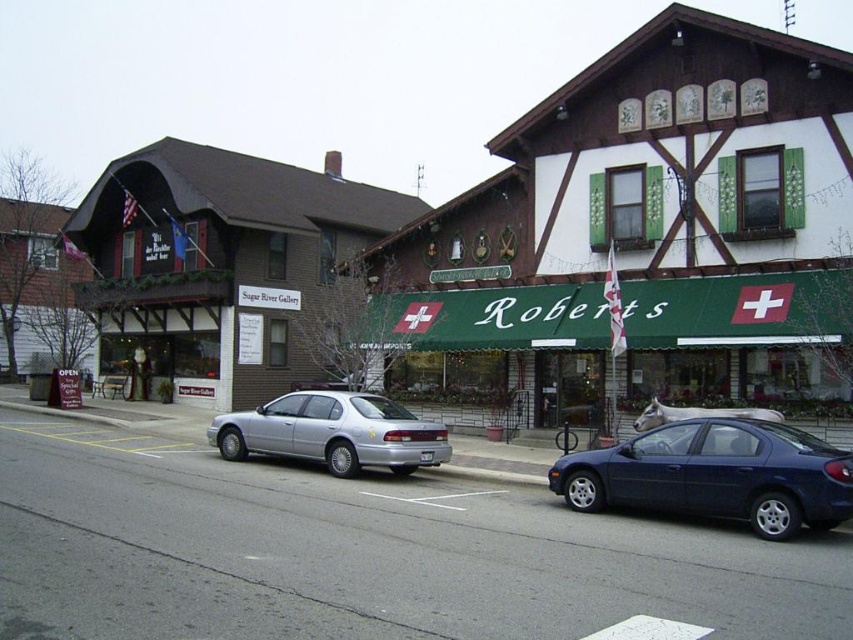
You are a delivery driver who needs to park your 1.8 meters wide truck between the glossy blue sedan at lower right and the silver metallic sedan at center. Can your truck fit in the space between them?

The glossy blue sedan at lower right has a lesser width compared to silver metallic sedan at center. Since the glossy blue sedan at lower right is narrower, the space between them might be sufficient for your 1.8 meters wide truck. However, without knowing the exact distance between the two sedans, it is difficult to confirm if the truck can fit.

You are a delivery person who needs to park your glossy blue sedan at lower right. The parking spot is in front of the brick sugar river gallery at left. Is your vehicle currently positioned correctly?

The glossy blue sedan at lower right is behind the brick sugar river gallery at left, so it is not parked in front of it. The vehicle needs to be moved forward to the parking spot in front of the gallery.

You are standing on the sidewalk in front of the brick sugar river gallery at left. You want to cross the street to reach the Roberts building on the right. The crosswalk is 25 meters away from your current position. Can you safely reach the crosswalk before the traffic light turns red in 10 seconds?

The brick sugar river gallery at left is 24.45 meters away from the viewer. Since the crosswalk is 25 meters away, you can safely reach it within 10 seconds if you walk at an average speed of 2.5 meters per second.